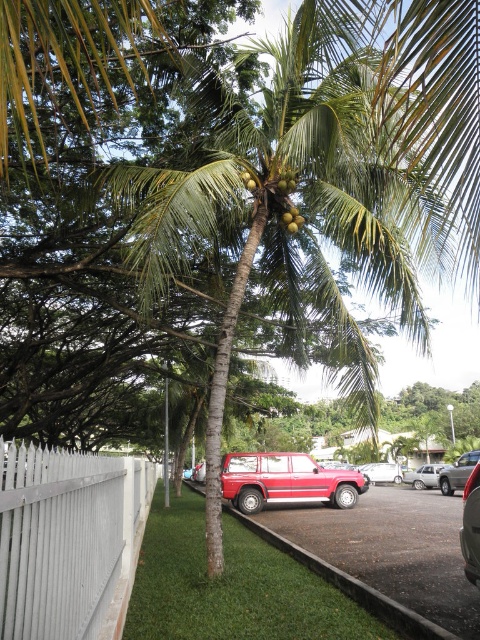
Question: Which point is closer to the camera taking this photo?

Choices:
 (A) (406, 483)
 (B) (274, 492)

Answer: (B)

Question: Is satin silver sedan at center positioned before green matte coconut at upper center?

Choices:
 (A) yes
 (B) no

Answer: (B)

Question: Which point is farther to the camera?

Choices:
 (A) (263, 490)
 (B) (236, 204)

Answer: (A)

Question: Does metallic silver car at lower right appear under satin silver sedan at center?

Choices:
 (A) yes
 (B) no

Answer: (B)

Question: Considering the real-world distances, which object is farthest from the green leafy palm tree at center?

Choices:
 (A) green matte coconuts at upper center
 (B) metallic silver car at lower right
 (C) satin silver sedan at center
 (D) green matte coconut at center

Answer: (C)

Question: Does green leafy palm tree at center have a greater width compared to metallic silver car at lower right?

Choices:
 (A) no
 (B) yes

Answer: (A)